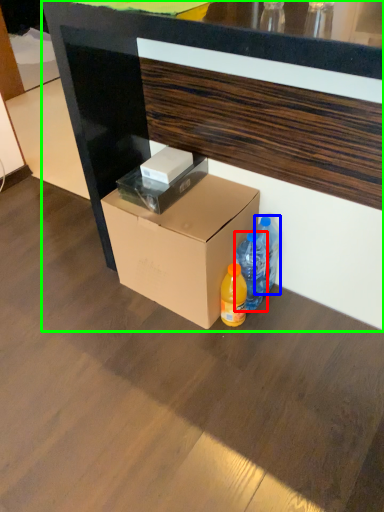
Question: Which object is the closest to the bottle (highlighted by a red box)? Choose among these: bottle (highlighted by a blue box) or desk (highlighted by a green box).

Choices:
 (A) bottle
 (B) desk

Answer: (A)